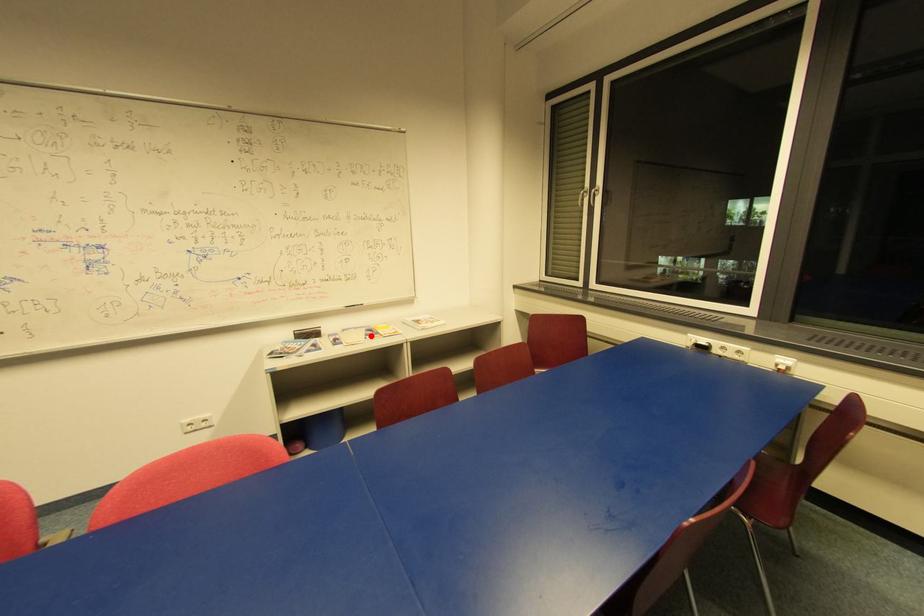
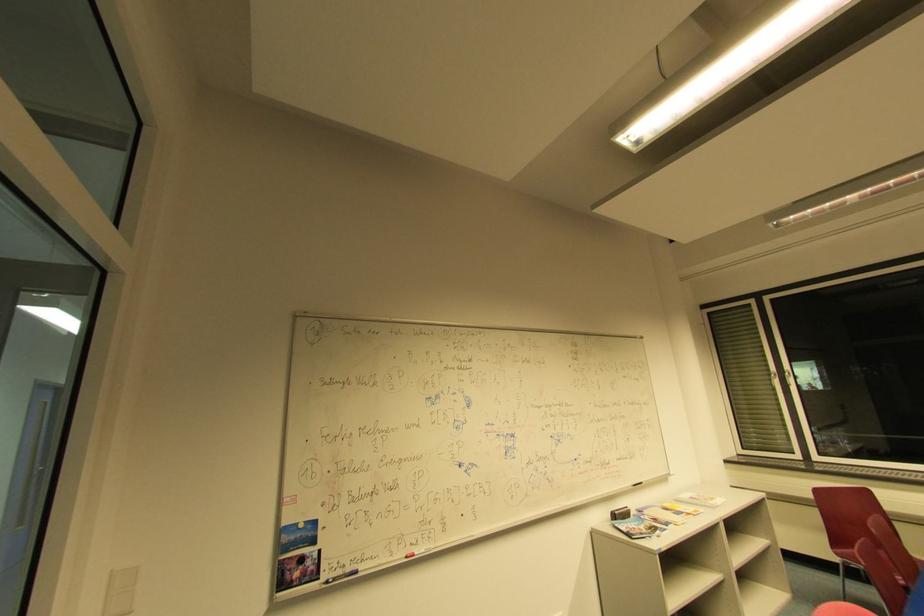
Where in the second image is the point corresponding to the highlighted location from the first image?

(679, 515)